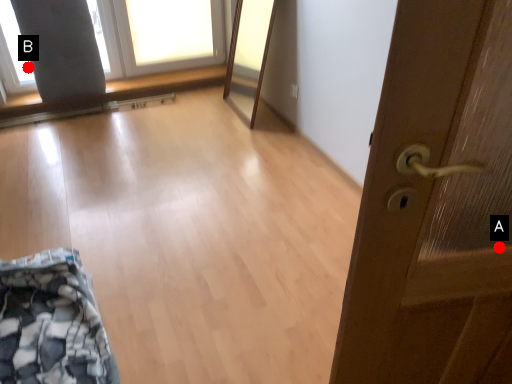
Question: Two points are circled on the image, labeled by A and B beside each circle. Which of the following is the closest to the observer?

Choices:
 (A) A is closer
 (B) B is closer

Answer: (A)